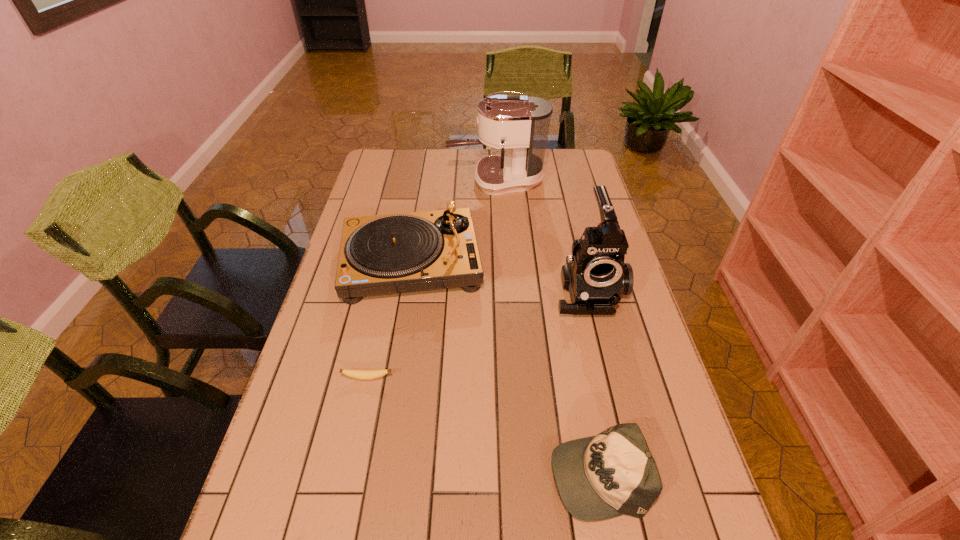
The image size is (960, 540). I want to click on baseball cap situated at the right edge, so click(613, 473).

This screenshot has height=540, width=960. Find the location of `free point at the far edge`. free point at the far edge is located at coordinates (488, 152).

Locate an element on the screen. This screenshot has height=540, width=960. vacant space at the left edge of the desktop is located at coordinates (341, 363).

Where is `free space at the right edge`? free space at the right edge is located at coordinates (619, 325).

At what (x,y) coordinates should I click in order to perform the action: click on free spot at the far right corner of the desktop. Please return your answer as a coordinate pair (x, y). The width and height of the screenshot is (960, 540). Looking at the image, I should click on (556, 171).

Identify the location of unoccupied position between the nearest object and the record player. (505, 368).

At what (x,y) coordinates should I click in order to perform the action: click on vacant area between the second tallest object and the nearest object. Please return your answer as a coordinate pair (x, y). The width and height of the screenshot is (960, 540). Looking at the image, I should click on (593, 381).

Where is `empty space between the third shortest object and the fourth shortest object`? This screenshot has height=540, width=960. empty space between the third shortest object and the fourth shortest object is located at coordinates (500, 276).

Locate an element on the screen. This screenshot has height=540, width=960. empty space that is in between the banana and the baseball cap is located at coordinates (483, 426).

In order to click on vacant area that lies between the second shortest object and the fourth farthest object in this screenshot , I will do `click(483, 426)`.